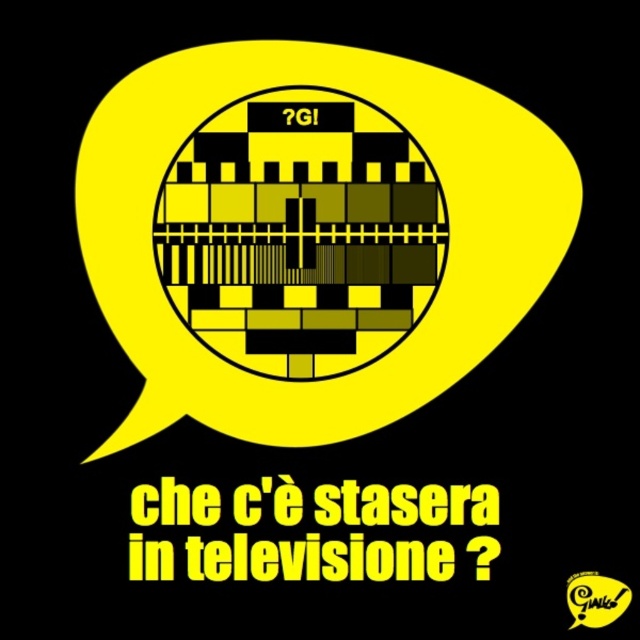
How far apart are yellow matte/black textured square at center and yellow rubber speech bubble at center?

yellow matte/black textured square at center is 18.39 inches away from yellow rubber speech bubble at center.

Locate an element on the screen. Image resolution: width=640 pixels, height=640 pixels. yellow matte/black textured square at center is located at coordinates coord(300,234).

Who is positioned more to the left, yellow matte/black textured square at center or black pixelated qr code at center?

From the viewer's perspective, yellow matte/black textured square at center appears more on the left side.

Is yellow matte/black textured square at center above black pixelated qr code at center?

Yes, yellow matte/black textured square at center is above black pixelated qr code at center.

Who is more distant from viewer, (353, 173) or (211, 572)?

Positioned behind is point (353, 173).

Image resolution: width=640 pixels, height=640 pixels. Find the location of `yellow matte/black textured square at center`. yellow matte/black textured square at center is located at coordinates (300, 234).

Looking at this image, does black pixelated qr code at center come behind yellow rubber speech bubble at center?

Yes, it is behind yellow rubber speech bubble at center.

Does black pixelated qr code at center appear under yellow rubber speech bubble at center?

No.

Does point (243, 540) come in front of point (593, 572)?

No, it is not.

You are a GUI agent. You are given a task and a screenshot of the screen. Output one action in this format:
    pyautogui.click(x=<x>, y=<y>)
    Task: Click on the black pixelated qr code at center
    
    Given the screenshot: What is the action you would take?
    pyautogui.click(x=317, y=560)